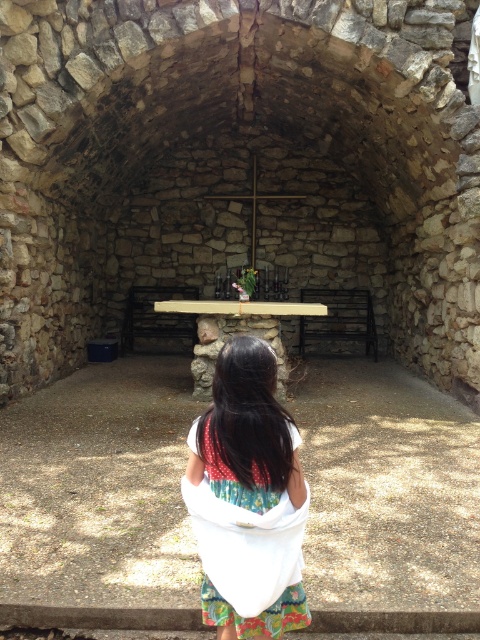
You are a visitor entering the chapel and notice the brown stone table at center and the white fabric at center. Which object is taller when observed from the entrance?

The white fabric at center is taller than the brown stone table at center.

You are standing at the entrance of the rustic stone chapel and notice a point marked at coordinates (99, 500). What does this point indicate in the scene?

The point at (99, 500) marks the location of the brown stone table at center.